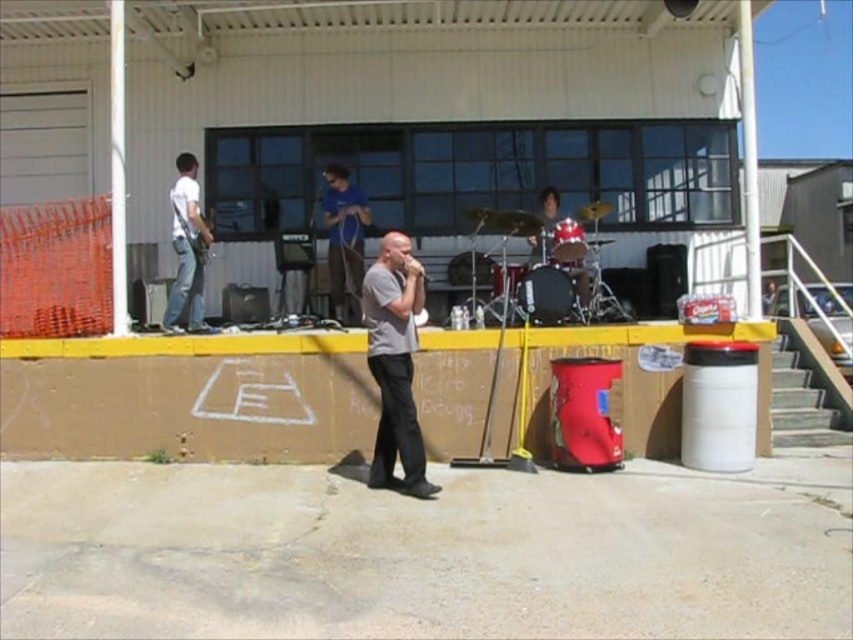
Looking at this image, is gray matte shirt at center to the right of white matte guitar at left from the viewer's perspective?

Correct, you'll find gray matte shirt at center to the right of white matte guitar at left.

Is gray matte shirt at center further to the viewer compared to white matte guitar at left?

No, gray matte shirt at center is closer to the viewer.

Find the location of a particular element. Image resolution: width=853 pixels, height=640 pixels. gray matte shirt at center is located at coordinates (393, 364).

Can you confirm if gray matte shirt at center is thinner than blue cotton shirt at center?

In fact, gray matte shirt at center might be wider than blue cotton shirt at center.

Is gray matte shirt at center to the left of blue cotton shirt at center from the viewer's perspective?

Incorrect, gray matte shirt at center is not on the left side of blue cotton shirt at center.

This screenshot has height=640, width=853. In order to click on gray matte shirt at center in this screenshot , I will do `click(393, 364)`.

Measure the distance between white matte guitar at left and camera.

white matte guitar at left is 25.86 feet from camera.

In the scene shown: Between white matte guitar at left and blue cotton shirt at center, which one has less height?

blue cotton shirt at center

Where is `white matte guitar at left`? This screenshot has width=853, height=640. white matte guitar at left is located at coordinates (187, 252).